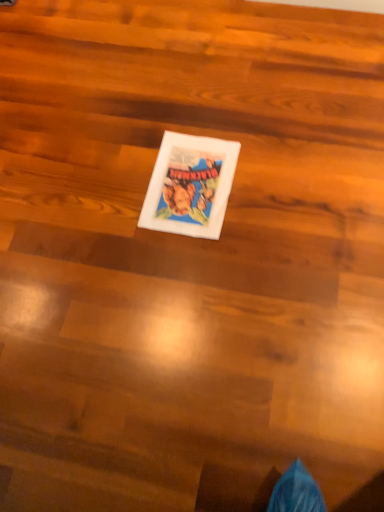
Where is `free space in front of white matte comic book at center`? The image size is (384, 512). free space in front of white matte comic book at center is located at coordinates (203, 270).